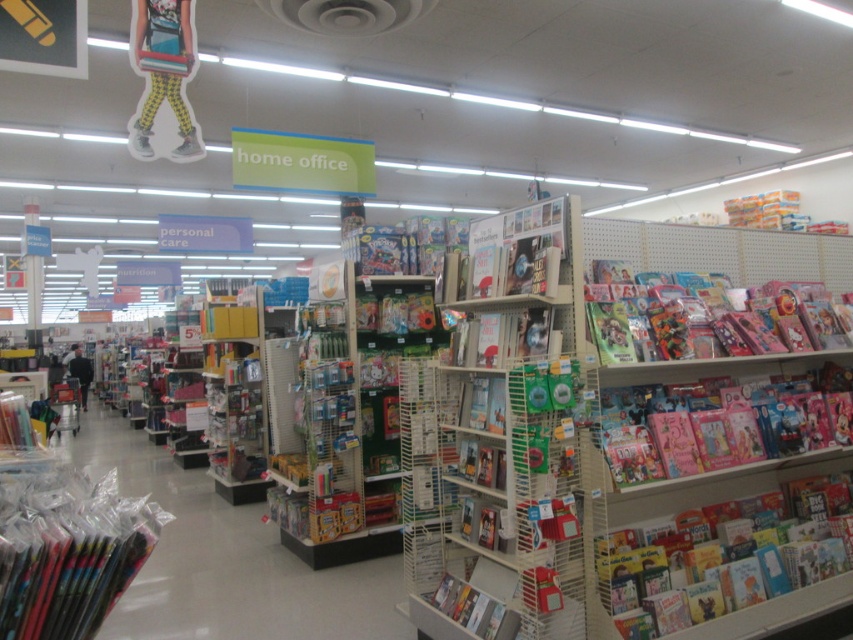
Is point (825, 429) farther from camera compared to point (498, 627)?

Yes, point (825, 429) is farther from viewer.

Does pink glossy book at right appear over matte cardboard magazine at lower center?

Correct, pink glossy book at right is located above matte cardboard magazine at lower center.

Which is in front, point (807, 412) or point (444, 604)?

Positioned in front is point (444, 604).

The height and width of the screenshot is (640, 853). I want to click on pink glossy book at right, so click(x=715, y=428).

Which is behind, point (756, 436) or point (846, 632)?

Point (846, 632)

Does pink glossy book at right appear on the right side of hardcover book at lower right?

Yes, pink glossy book at right is to the right of hardcover book at lower right.

Does point (616, 465) come closer to viewer compared to point (807, 611)?

Yes, point (616, 465) is in front of point (807, 611).

Identify the location of pink glossy book at right. (715, 428).

Between white cardboard books at center and hardcover book at lower right, which one is positioned lower?

Positioned lower is hardcover book at lower right.

The height and width of the screenshot is (640, 853). Describe the element at coordinates (502, 438) in the screenshot. I see `white cardboard books at center` at that location.

Between point (521, 387) and point (773, 609), which one is positioned in front?

Positioned in front is point (521, 387).

Locate an element on the screen. The width and height of the screenshot is (853, 640). white cardboard books at center is located at coordinates (502, 438).